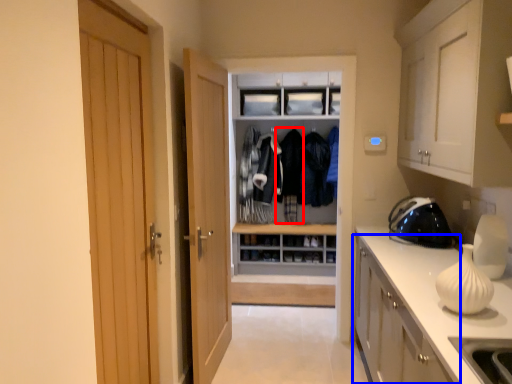
Question: Which of the following is the farthest to the observer, clothing (highlighted by a red box) or cabinetry (highlighted by a blue box)?

Choices:
 (A) clothing
 (B) cabinetry

Answer: (A)